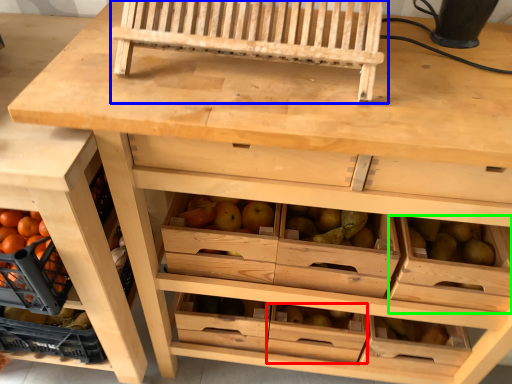
Question: Considering the real-world distances, which object is closest to drawer (highlighted by a red box)? church bench (highlighted by a blue box) or drawer (highlighted by a green box).

Choices:
 (A) church bench
 (B) drawer

Answer: (B)